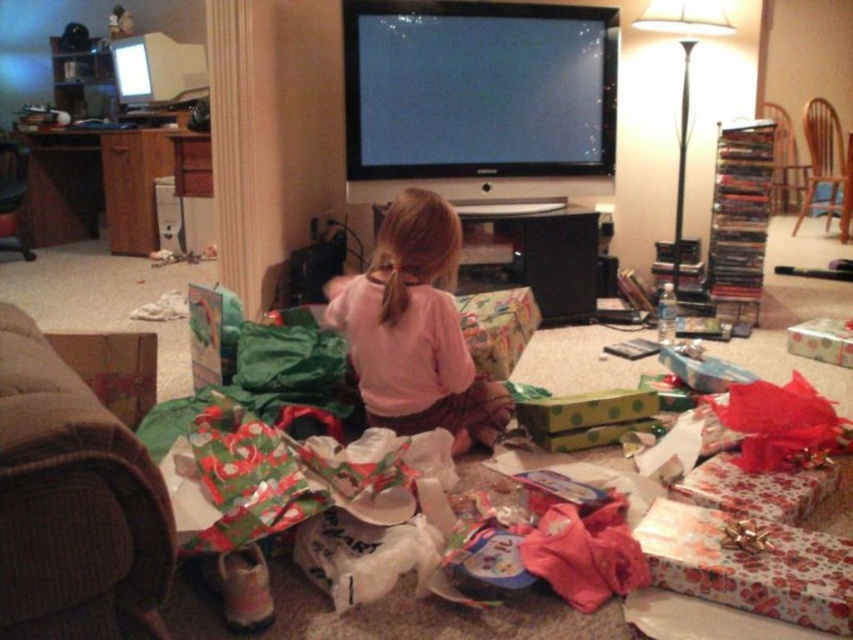
You are a delivery person who just arrived at the house. You need to place a package that is 5 meters long in the living room without blocking the entrance. The living room has the pink cotton shirt at center and the brown wooden chair at upper right. Can you fit the package between them?

The distance between the pink cotton shirt at center and the brown wooden chair at upper right is 4.75 meters. Since the package is 5 meters long, it cannot fit between them as the space is shorter than the package.

You are a delivery person who needs to place a new package on the surface between the pink cotton shirt at center and the brown wooden chair at upper right. Can you tell me if there is enough space for the package?

The pink cotton shirt at center is thinner than the brown wooden chair at upper right, so there is sufficient space between them to place the package.